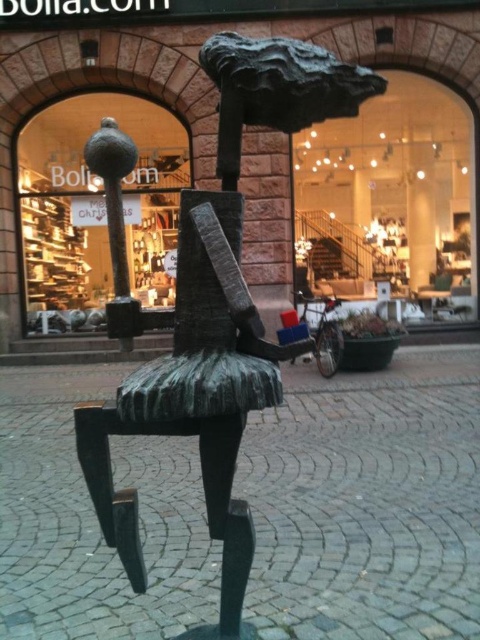
Question: Is matte glass vase at upper center thinner than metallic polished chair at center?

Choices:
 (A) yes
 (B) no

Answer: (A)

Question: Is matte glass vase at upper center smaller than metallic polished chair at center?

Choices:
 (A) yes
 (B) no

Answer: (A)

Question: Considering the relative positions of matte glass vase at upper center and metallic polished chair at center in the image provided, where is matte glass vase at upper center located with respect to metallic polished chair at center?

Choices:
 (A) above
 (B) below

Answer: (A)

Question: Which point is closer to the camera taking this photo?

Choices:
 (A) (82, 138)
 (B) (420, 285)

Answer: (A)